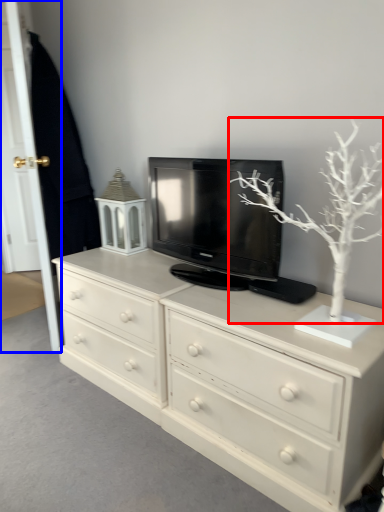
Question: Among these objects, which one is farthest to the camera, tree (highlighted by a red box) or door (highlighted by a blue box)?

Choices:
 (A) tree
 (B) door

Answer: (B)